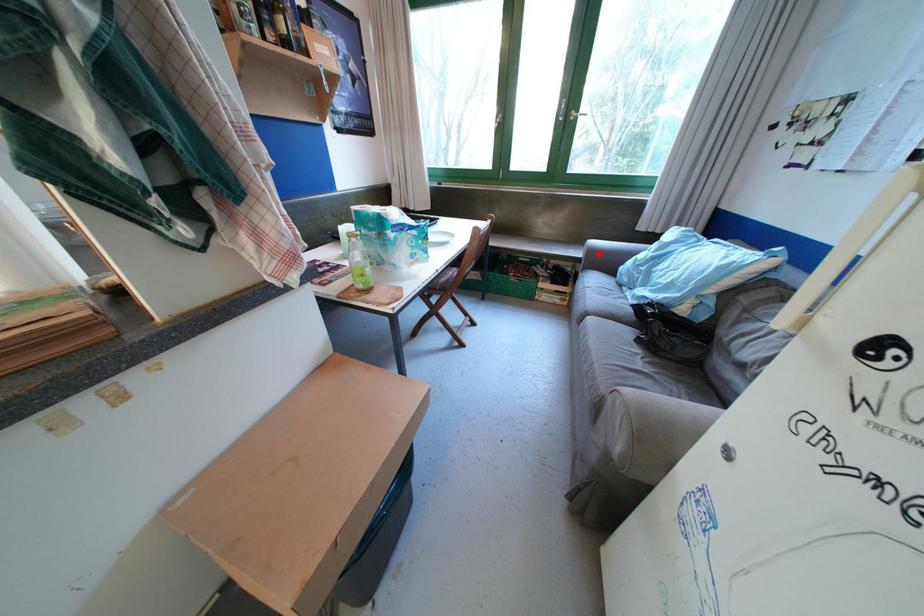
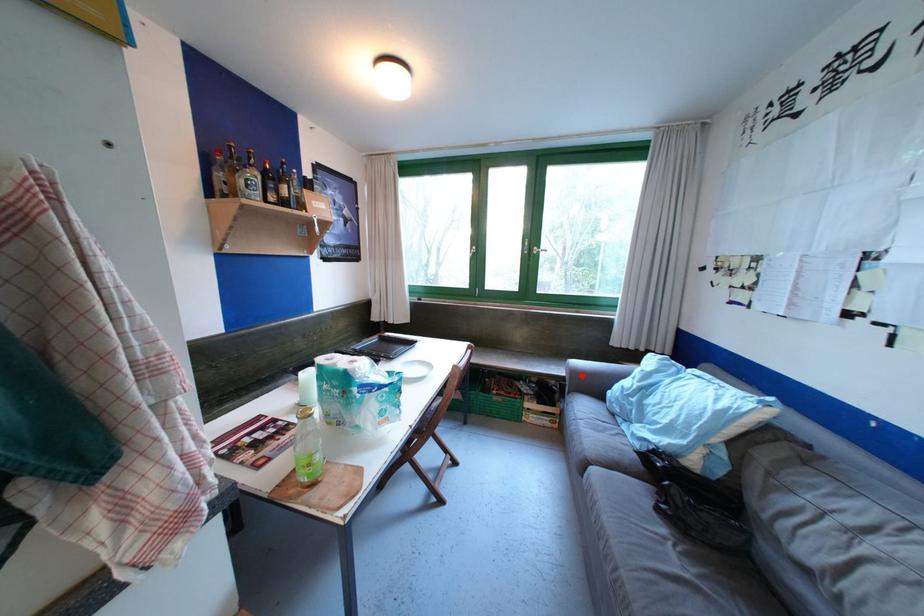
I am providing you with two images of the same scene from different viewpoints. A red point is marked on the first image and another point is marked on the second image. Does the point marked in image1 correspond to the same location as the one in image2?

Yes